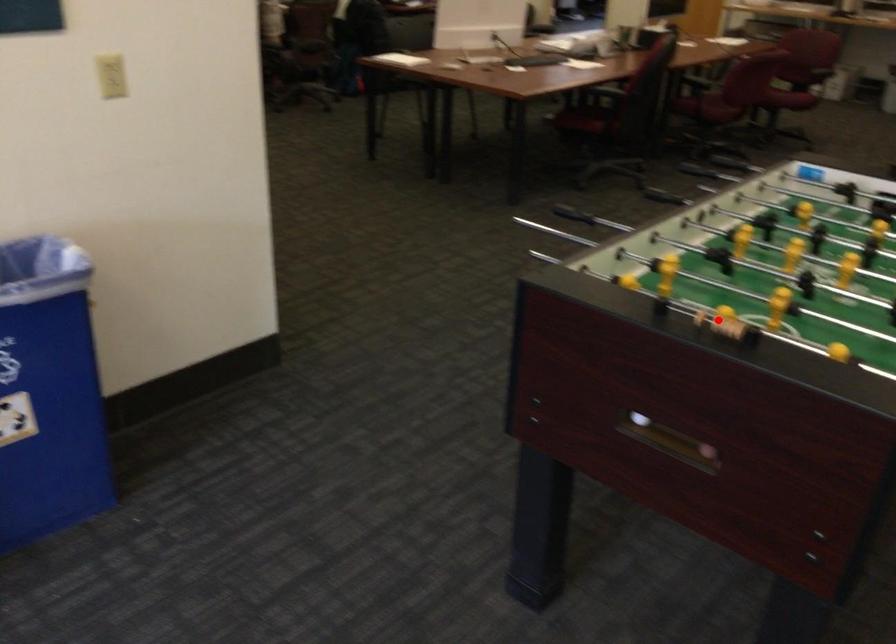
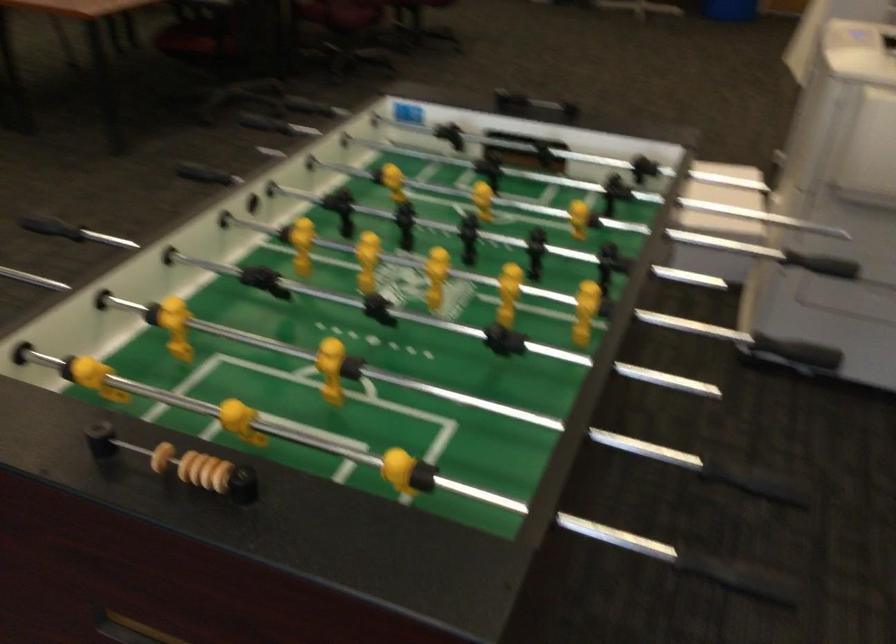
Question: I am providing you with two images of the same scene from different viewpoints. Given a red point in image1, look at the same physical point in image2. Is it:

Choices:
 (A) Closer to the viewpoint
 (B) Farther from the viewpoint

Answer: (A)